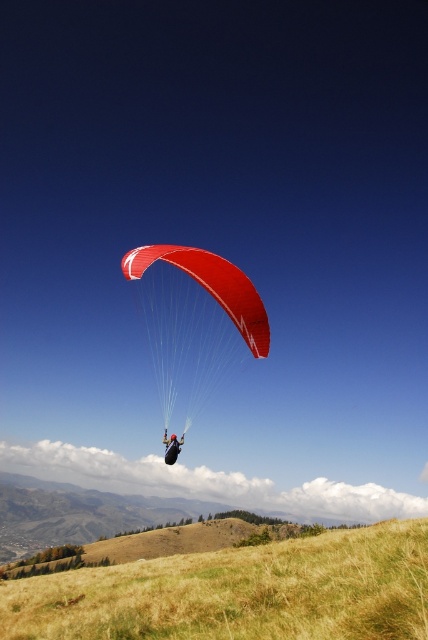
Question: Based on their relative distances, which object is farther from the shiny red parachute at center?

Choices:
 (A) golden dry grass at lower center
 (B) black fabric parachute at center

Answer: (B)

Question: Is shiny red parachute at center positioned before black fabric parachute at center?

Choices:
 (A) yes
 (B) no

Answer: (A)

Question: Is golden dry grass at lower center thinner than shiny red parachute at center?

Choices:
 (A) no
 (B) yes

Answer: (A)

Question: Is golden dry grass at lower center wider than shiny red parachute at center?

Choices:
 (A) yes
 (B) no

Answer: (A)

Question: Which point is closer to the camera?

Choices:
 (A) (261, 330)
 (B) (178, 449)

Answer: (B)

Question: Which object is the farthest from the black fabric parachute at center?

Choices:
 (A) shiny red parachute at center
 (B) golden dry grass at lower center

Answer: (A)